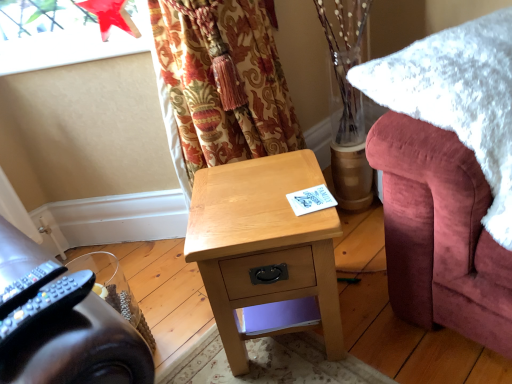
Question: From the image's perspective, is black plastic remote control at lower left, which is counted as the 2th remote control, starting from the right, located beneath transparent glass window screen at upper left?

Choices:
 (A) yes
 (B) no

Answer: (A)

Question: Is black plastic remote control at lower left, which is counted as the 2th remote control, starting from the right, smaller than transparent glass window screen at upper left?

Choices:
 (A) no
 (B) yes

Answer: (B)

Question: Is black plastic remote control at lower left, which is counted as the 2th remote control, starting from the right, taller than transparent glass window screen at upper left?

Choices:
 (A) yes
 (B) no

Answer: (A)

Question: Is black plastic remote control at lower left, which is counted as the 2th remote control, starting from the right, at the right side of transparent glass window screen at upper left?

Choices:
 (A) yes
 (B) no

Answer: (A)

Question: Is black plastic remote control at lower left, the first remote control from the left, wider than transparent glass window screen at upper left?

Choices:
 (A) yes
 (B) no

Answer: (B)

Question: From a real-world perspective, is black plastic remote control at lower left, which is counted as the 2th remote control, starting from the right, under transparent glass window screen at upper left?

Choices:
 (A) no
 (B) yes

Answer: (B)

Question: From a real-world perspective, is white fluffy blanket at right physically below black plastic remote control at lower left, placed as the 1th remote control when sorted from right to left?

Choices:
 (A) no
 (B) yes

Answer: (B)

Question: Does white fluffy blanket at right have a greater height compared to black plastic remote control at lower left, the 2th remote control from the left?

Choices:
 (A) yes
 (B) no

Answer: (A)

Question: Is white fluffy blanket at right aimed at black plastic remote control at lower left, the 2th remote control from the left?

Choices:
 (A) no
 (B) yes

Answer: (A)

Question: From the image's perspective, is white fluffy blanket at right over black plastic remote control at lower left, placed as the 1th remote control when sorted from right to left?

Choices:
 (A) yes
 (B) no

Answer: (A)

Question: Considering the relative sizes of white fluffy blanket at right and black plastic remote control at lower left, the 2th remote control from the left, in the image provided, is white fluffy blanket at right smaller than black plastic remote control at lower left, the 2th remote control from the left,?

Choices:
 (A) yes
 (B) no

Answer: (B)

Question: From a real-world perspective, is white fluffy blanket at right located higher than black plastic remote control at lower left, the 2th remote control from the left?

Choices:
 (A) no
 (B) yes

Answer: (A)

Question: Can you confirm if black plastic remote control at lower left, the 2th remote control from the left, is taller than transparent glass window screen at upper left?

Choices:
 (A) yes
 (B) no

Answer: (A)